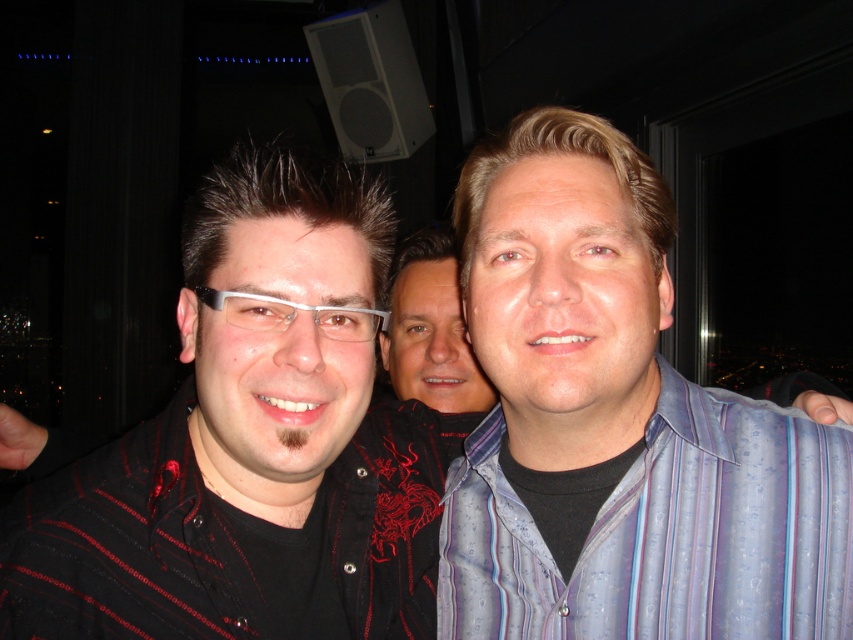
You are a photographer at the event and want to adjust your camera focus. Which object should you focus on first, the smooth black shirt at center or the white plastic glasses at center, considering their positions?

The smooth black shirt at center is below the white plastic glasses at center, so you should focus on the white plastic glasses at center first as it is higher up.

Based on the photo, you are standing in a dimly lit room at a social gathering. You see two points marked in the scene. Which point is closer to you, point (418,307) or point (236,300)?

Point (418,307) is further to the viewer than point (236,300), so point (236,300) is closer to you.